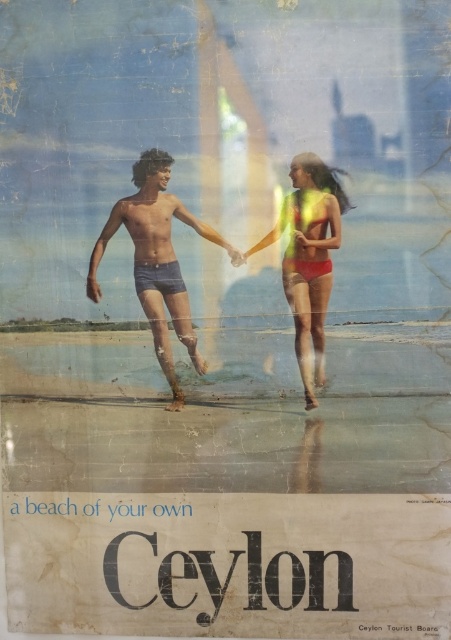
Question: Is blue denim shorts at center closer to the viewer compared to matte yellow bikini at center?

Choices:
 (A) yes
 (B) no

Answer: (B)

Question: Is blue denim shorts at center below matte yellow bikini at center?

Choices:
 (A) yes
 (B) no

Answer: (B)

Question: Considering the relative positions of blue denim shorts at center and matte yellow bikini at center in the image provided, where is blue denim shorts at center located with respect to matte yellow bikini at center?

Choices:
 (A) below
 (B) above

Answer: (B)